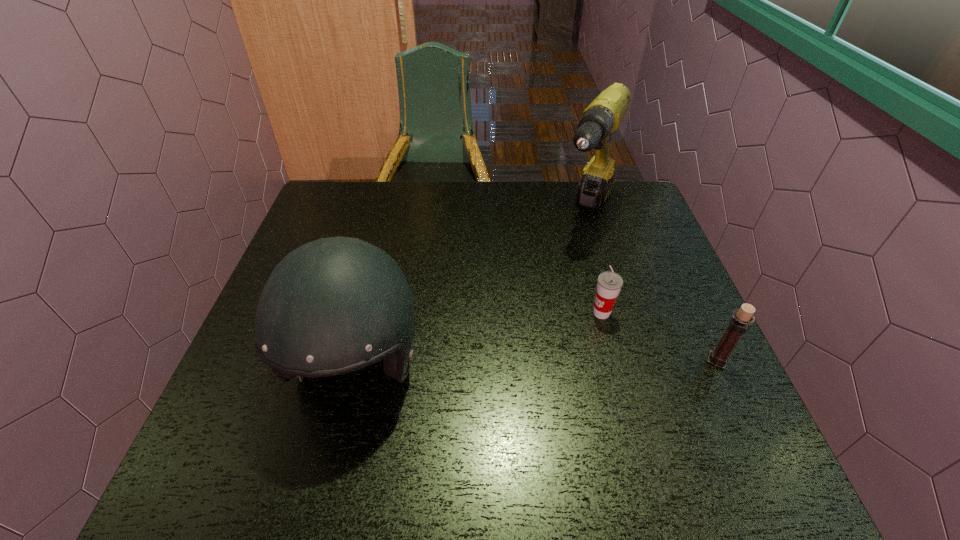
You are a GUI agent. You are given a task and a screenshot of the screen. Output one action in this format:
    pyautogui.click(x=<x>, y=<y>)
    Task: Click on the vacant region at the near edge of the desktop
    
    Given the screenshot: What is the action you would take?
    pyautogui.click(x=623, y=424)

In the image, there is a desktop. Find the location of `free space at the left edge`. free space at the left edge is located at coordinates (322, 228).

At what (x,y) coordinates should I click in order to perform the action: click on vacant space at the right edge of the desktop. Please return your answer as a coordinate pair (x, y). This screenshot has height=540, width=960. Looking at the image, I should click on (638, 240).

Where is `vacant space at the far left corner of the desktop`? The height and width of the screenshot is (540, 960). vacant space at the far left corner of the desktop is located at coordinates [x=316, y=205].

Find the location of a particular element. The height and width of the screenshot is (540, 960). vacant space at the near left corner of the desktop is located at coordinates (261, 428).

This screenshot has width=960, height=540. I want to click on free space at the far right corner of the desktop, so click(x=654, y=224).

This screenshot has height=540, width=960. In the image, there is a desktop. In order to click on vacant space at the near right corner in this screenshot , I will do `click(722, 396)`.

Locate an element on the screen. vacant space that's between the candle holder and the football helmet is located at coordinates (536, 363).

Where is `unoccupied area between the cup and the drill`? unoccupied area between the cup and the drill is located at coordinates (594, 263).

Locate an element on the screen. free space between the shortest object and the rightmost object is located at coordinates (660, 337).